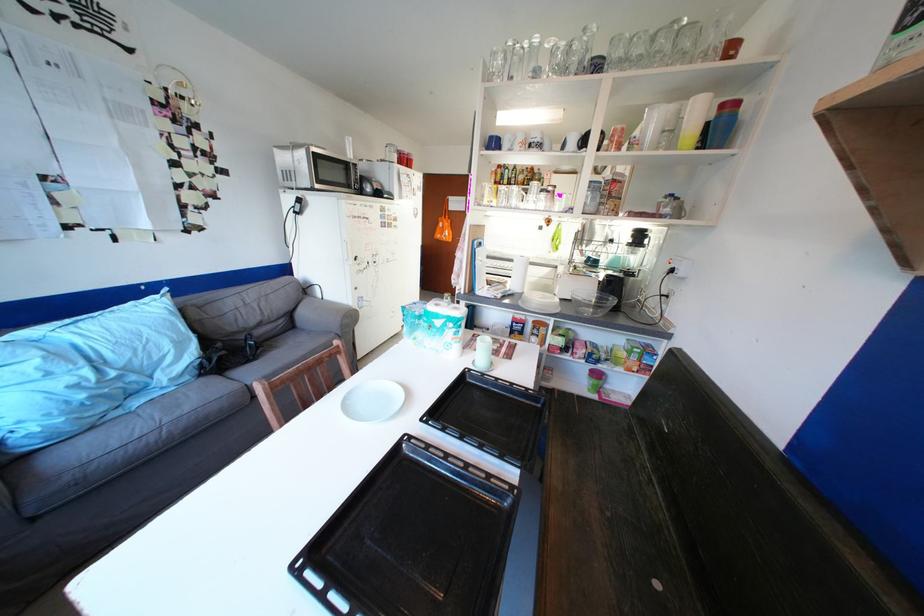
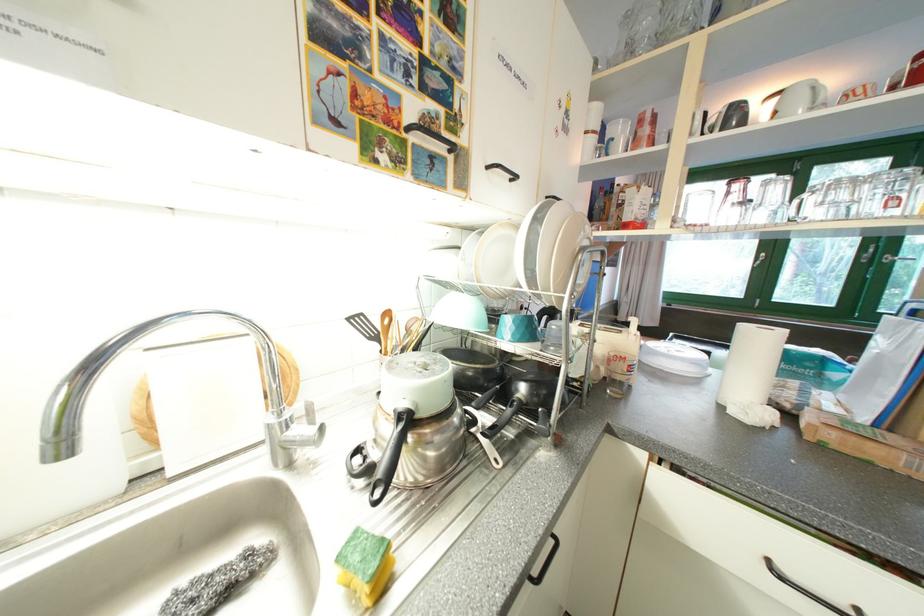
Question: I am providing you with two images of the same scene from different viewpoints. After the viewpoint changes to image2, which objects are now occluded?

Choices:
 (A) kettle handle
 (B) blender pitcher
 (C) white back pillow
 (D) black cabinet handle

Answer: (B)